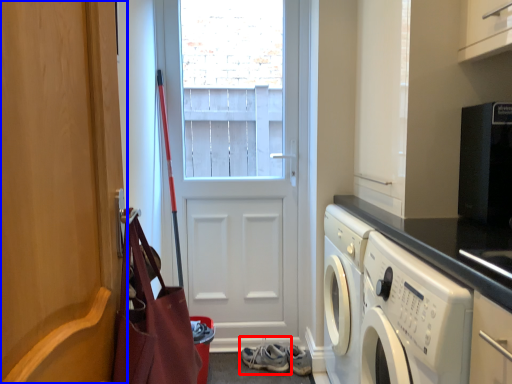
Question: Which object appears closest to the camera in this image, footwear (highlighted by a red box) or door (highlighted by a blue box)?

Choices:
 (A) footwear
 (B) door

Answer: (B)